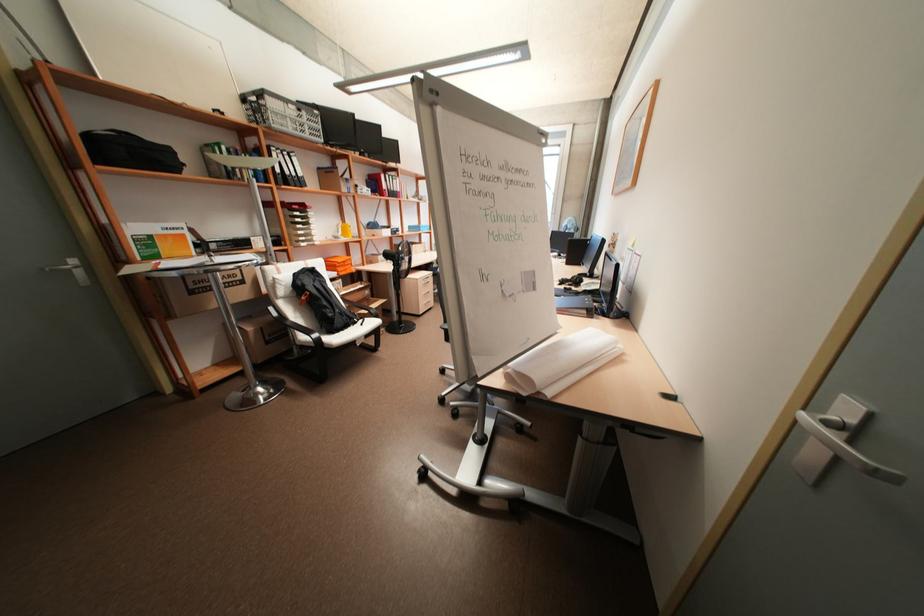
Where would you pull the green binder? Please return your answer as a coordinate pair (x, y).

(152, 238)